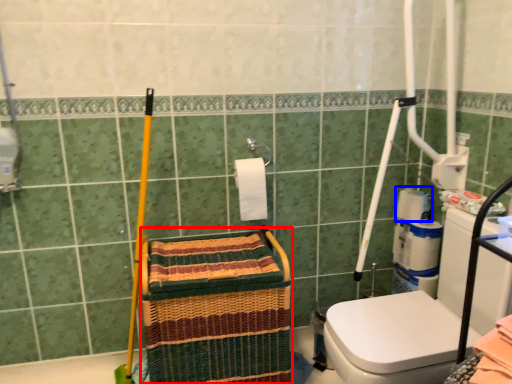
Question: Which object appears farthest to the camera in this image, basket (highlighted by a red box) or toilet paper (highlighted by a blue box)?

Choices:
 (A) basket
 (B) toilet paper

Answer: (B)